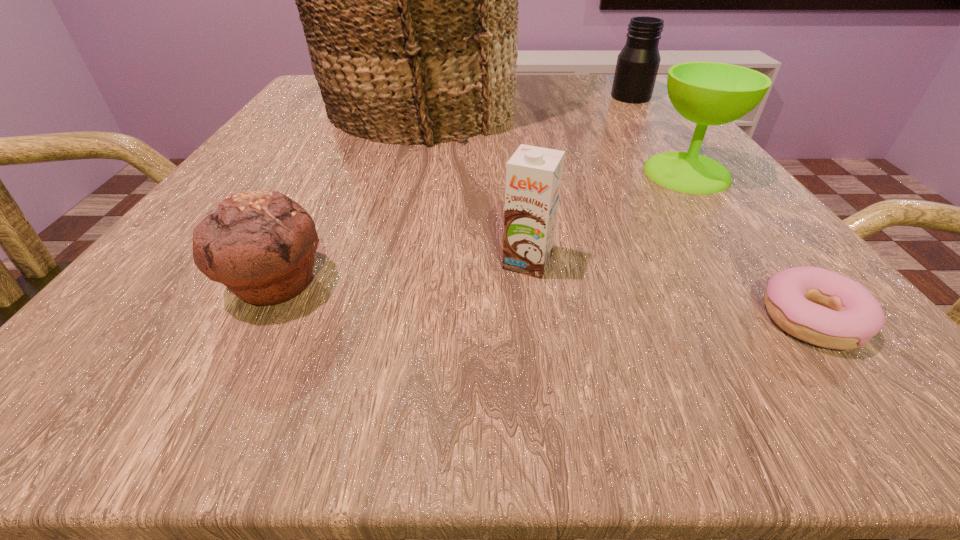
You are a GUI agent. You are given a task and a screenshot of the screen. Output one action in this format:
    pyautogui.click(x=<x>, y=<y>)
    Task: Click on the free space between the basket and the jar
    
    Given the screenshot: What is the action you would take?
    pyautogui.click(x=524, y=102)

At what (x,y) coordinates should I click in order to perform the action: click on empty space between the tallest object and the chocolate milk. Please return your answer as a coordinate pair (x, y). Looking at the image, I should click on (473, 185).

Locate which object ranks fifth in proximity to the fifth tallest object. Please provide its 2D coordinates. Your answer should be formatted as a tuple, i.e. [(x, y)], where the tuple contains the x and y coordinates of a point satisfying the conditions above.

[(637, 66)]

Identify which object is the third nearest to the tallest object. Please provide its 2D coordinates. Your answer should be formatted as a tuple, i.e. [(x, y)], where the tuple contains the x and y coordinates of a point satisfying the conditions above.

[(533, 174)]